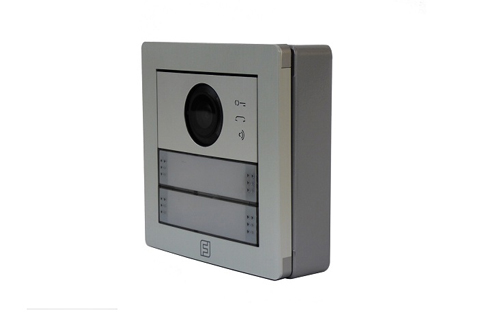
At what (x,y) coordinates should I click in order to perform the action: click on handle. Please return your answer as a coordinate pair (x, y). Looking at the image, I should click on (239, 120).